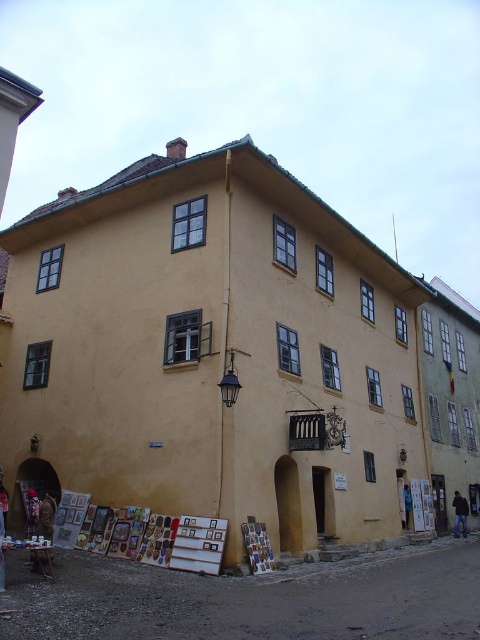
Question: Does wooden signboard at lower left have a lesser width compared to wooden framed paintings at lower left?

Choices:
 (A) no
 (B) yes

Answer: (A)

Question: Does dark brown leather jacket at lower right come behind wooden framed paintings at lower left?

Choices:
 (A) yes
 (B) no

Answer: (A)

Question: Which point is farther to the camera?

Choices:
 (A) (39, 516)
 (B) (407, 502)
 (C) (468, 509)
 (D) (1, 538)

Answer: (C)

Question: Which point is farther to the camera?

Choices:
 (A) wooden signboard at lower left
 (B) brown leather jacket at lower left
 (C) brown leather jacket at lower right

Answer: (C)

Question: Which point is farther from the camera taking this photo?

Choices:
 (A) (0, 536)
 (B) (408, 515)

Answer: (B)

Question: Is dark brown leather jacket at lower right below brown leather jacket at lower right?

Choices:
 (A) no
 (B) yes

Answer: (B)